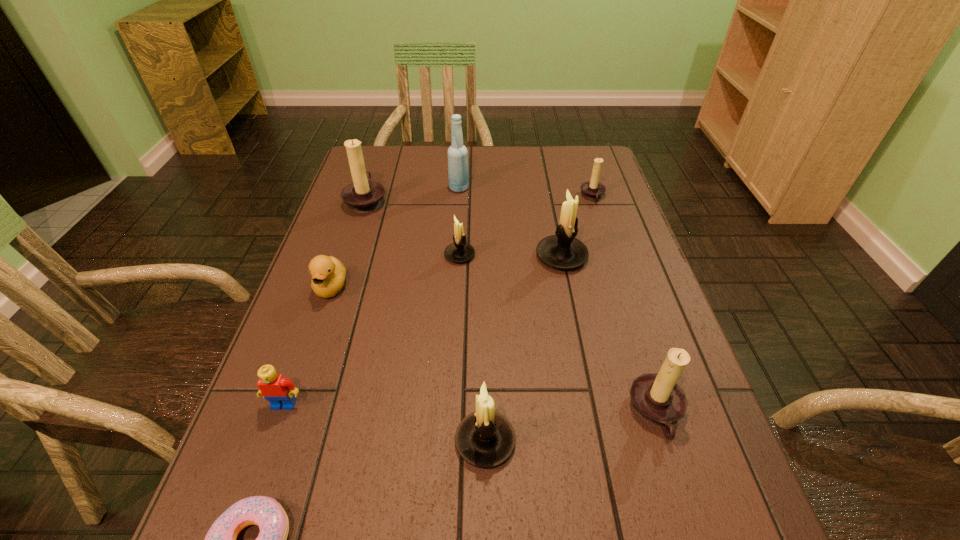
Locate an element on the screen. The height and width of the screenshot is (540, 960). duckling is located at coordinates (328, 273).

The height and width of the screenshot is (540, 960). In order to click on free space located 0.390m on the right of the bottle in this screenshot , I will do `click(595, 188)`.

Where is `free space located on the wick of the leftmost brown candle holder`? free space located on the wick of the leftmost brown candle holder is located at coordinates (498, 200).

You are a GUI agent. You are given a task and a screenshot of the screen. Output one action in this format:
    pyautogui.click(x=<x>, y=<y>)
    Task: Click on the vacant region located on the back of the rightmost white candle holder
    This screenshot has width=960, height=540.
    Given the screenshot: What is the action you would take?
    click(x=548, y=191)

The height and width of the screenshot is (540, 960). What are the coordinates of `blank space located 0.350m on the wick of the second smallest brown candle holder` in the screenshot? It's located at (441, 413).

This screenshot has width=960, height=540. What are the coordinates of `vacant space located on the wick of the second smallest brown candle holder` in the screenshot? It's located at (451, 413).

Where is `vacant area situated on the wick of the second smallest brown candle holder`? The width and height of the screenshot is (960, 540). vacant area situated on the wick of the second smallest brown candle holder is located at coordinates (560, 413).

The image size is (960, 540). In order to click on vacant space located 0.230m on the right of the second biggest white candle holder in this screenshot , I will do `click(646, 441)`.

Where is `vacant space located on the wick of the smallest brown candle holder`? vacant space located on the wick of the smallest brown candle holder is located at coordinates (543, 197).

Where is `free spot located 0.220m on the wick of the smallest brown candle holder`? The image size is (960, 540). free spot located 0.220m on the wick of the smallest brown candle holder is located at coordinates (507, 197).